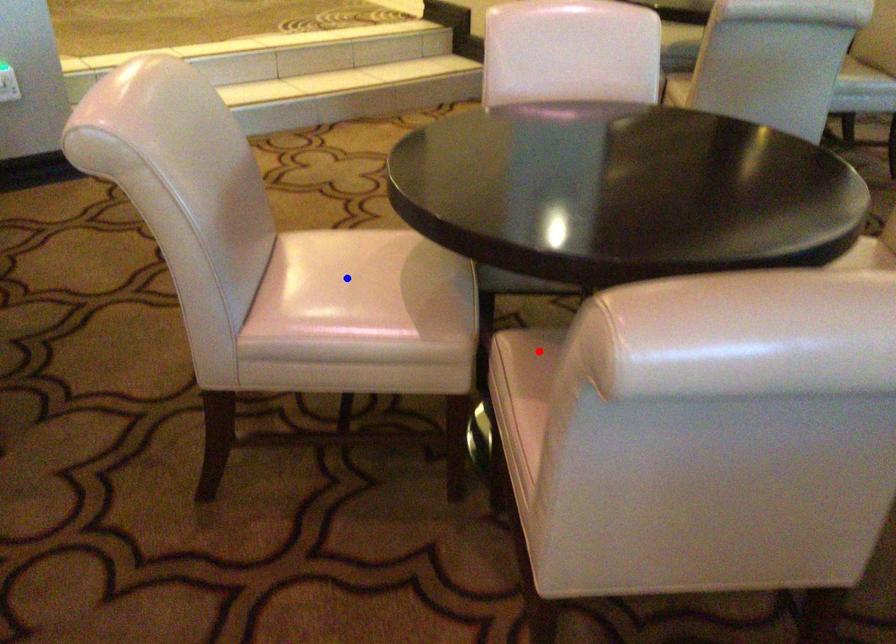
Question: Which of the two points in the image is closer to the camera?

Choices:
 (A) Blue point is closer.
 (B) Red point is closer.

Answer: (B)